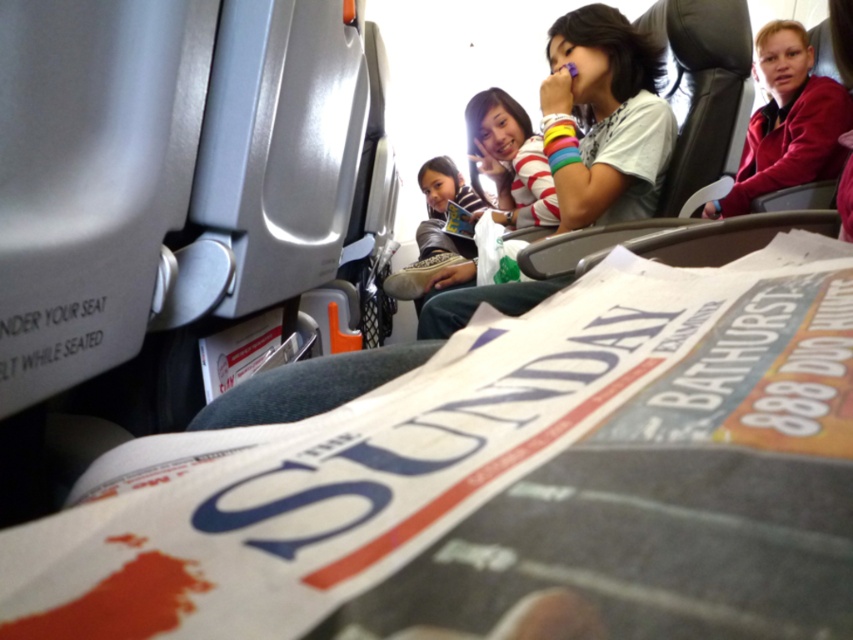
Is point (606, 170) farther from camera compared to point (820, 102)?

That is False.

Who is lower down, white striped shirt at upper center or maroon fabric jacket at upper right?

white striped shirt at upper center

Where is `white striped shirt at upper center`? The width and height of the screenshot is (853, 640). white striped shirt at upper center is located at coordinates (604, 118).

What are the coordinates of `white striped shirt at upper center` in the screenshot? It's located at (604, 118).

Is white glossy newspaper at center smaller than maroon fabric jacket at upper right?

Indeed, white glossy newspaper at center has a smaller size compared to maroon fabric jacket at upper right.

Can you confirm if white glossy newspaper at center is thinner than maroon fabric jacket at upper right?

Yes, white glossy newspaper at center is thinner than maroon fabric jacket at upper right.

Between point (674, 436) and point (795, 64), which one is positioned behind?

Positioned behind is point (795, 64).

At what (x,y) coordinates should I click in order to perform the action: click on white glossy newspaper at center. Please return your answer as a coordinate pair (x, y). Looking at the image, I should click on (505, 483).

Who is more distant from viewer, (631,499) or (634,122)?

The point (634,122) is more distant.

Locate an element on the screen. white glossy newspaper at center is located at coordinates pos(505,483).